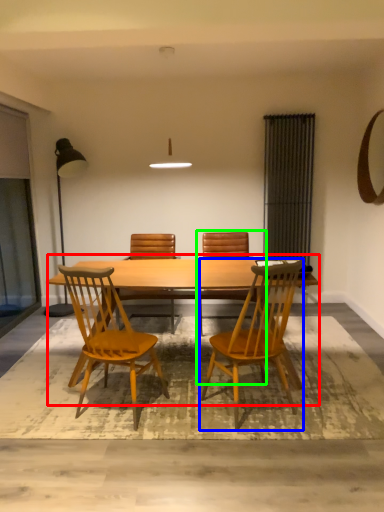
Question: Which is farther away from kitchen & dining room table (highlighted by a red box)? chair (highlighted by a blue box) or chair (highlighted by a green box)?

Choices:
 (A) chair
 (B) chair

Answer: (B)